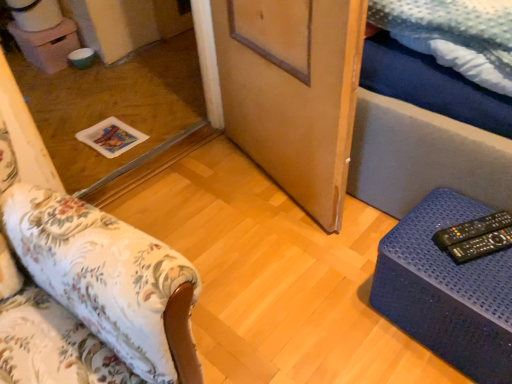
I want to click on free space in front of black plastic remote at lower right, which is the 1th remote in front-to-back order, so click(x=489, y=284).